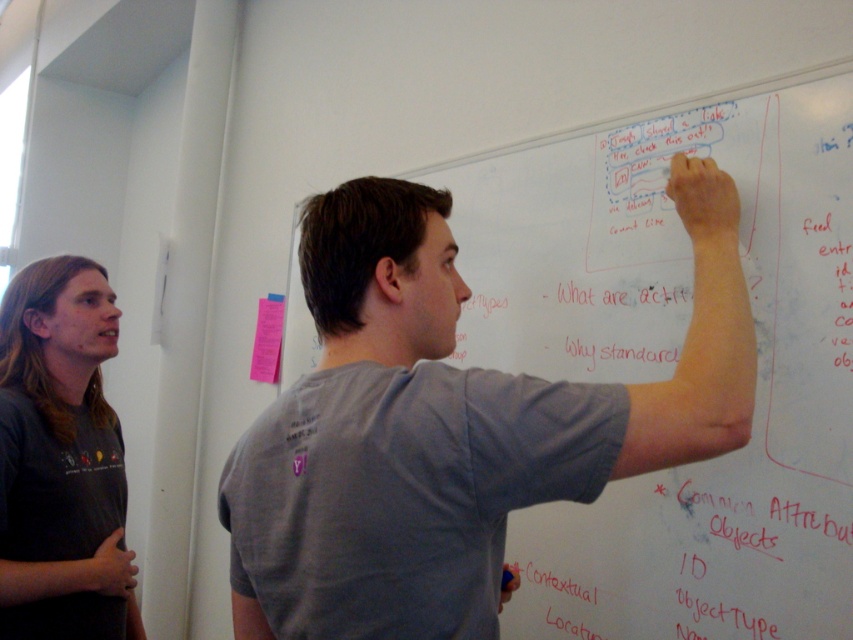
Question: Is gray matte shirt at upper center thinner than black t-shirt at left?

Choices:
 (A) no
 (B) yes

Answer: (A)

Question: Which object is the closest to the gray matte shirt at upper center?

Choices:
 (A) black t-shirt at left
 (B) pink paper at left

Answer: (A)

Question: Which object appears farthest from the camera in this image?

Choices:
 (A) black t-shirt at left
 (B) pink paper at left

Answer: (B)

Question: Considering the relative positions of gray matte shirt at upper center and black t-shirt at left in the image provided, where is gray matte shirt at upper center located with respect to black t-shirt at left?

Choices:
 (A) right
 (B) left

Answer: (A)

Question: Which point appears closest to the camera in this image?

Choices:
 (A) (103, 324)
 (B) (260, 348)
 (C) (364, 243)

Answer: (C)

Question: Is gray matte shirt at upper center below pink paper at left?

Choices:
 (A) yes
 (B) no

Answer: (B)